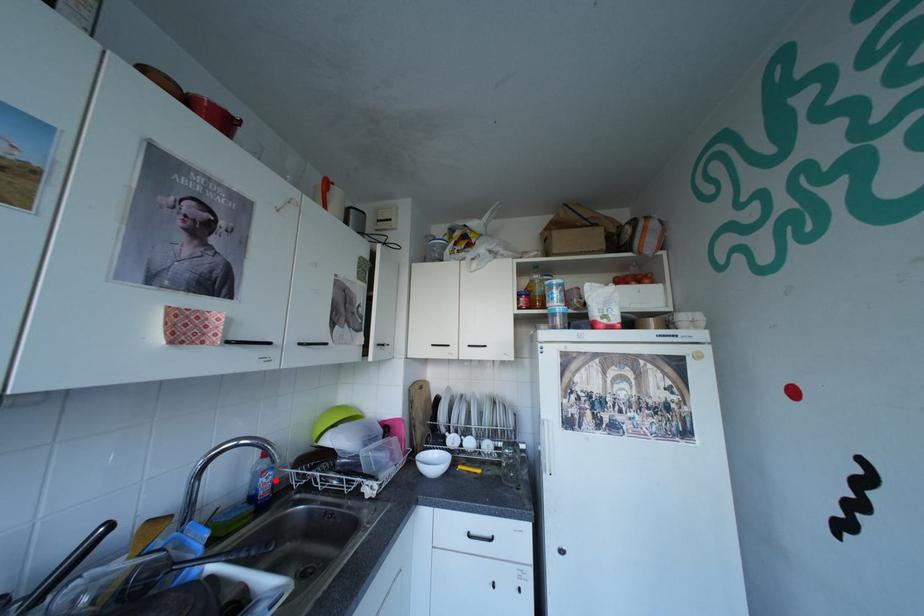
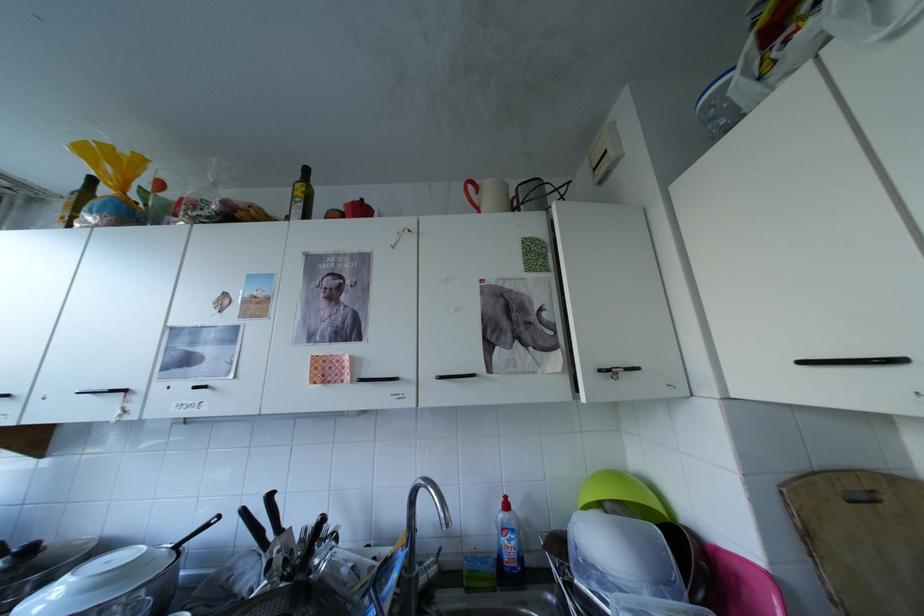
Where in the second image is the point corresponding to the highlighted location from the first image?

(517, 541)